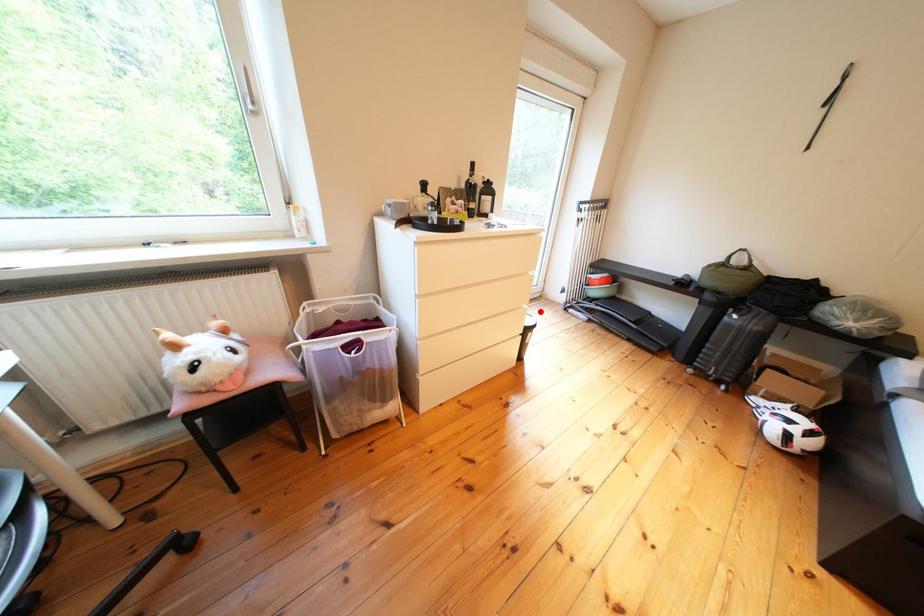
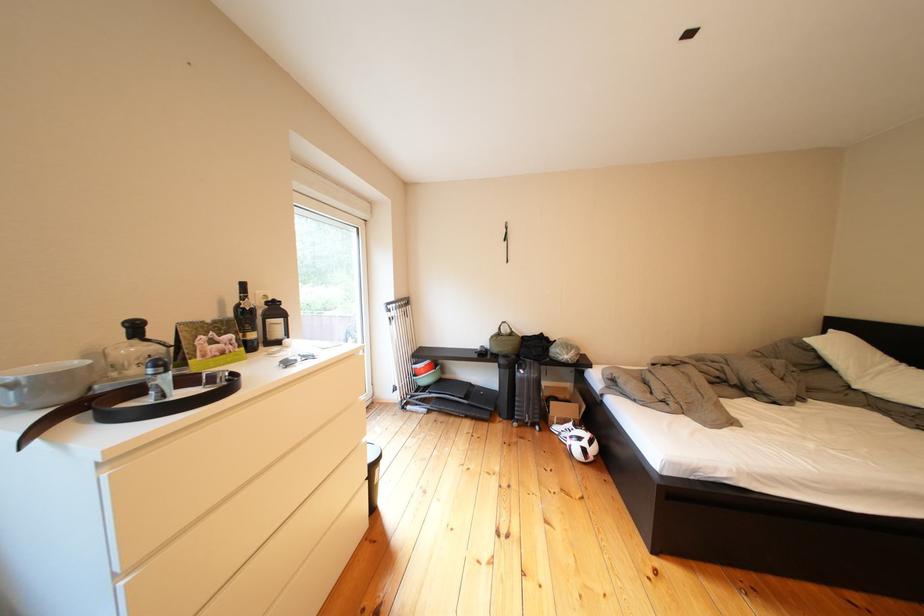
Locate, in the second image, the point that corresponds to the highlighted location in the first image.

(378, 445)